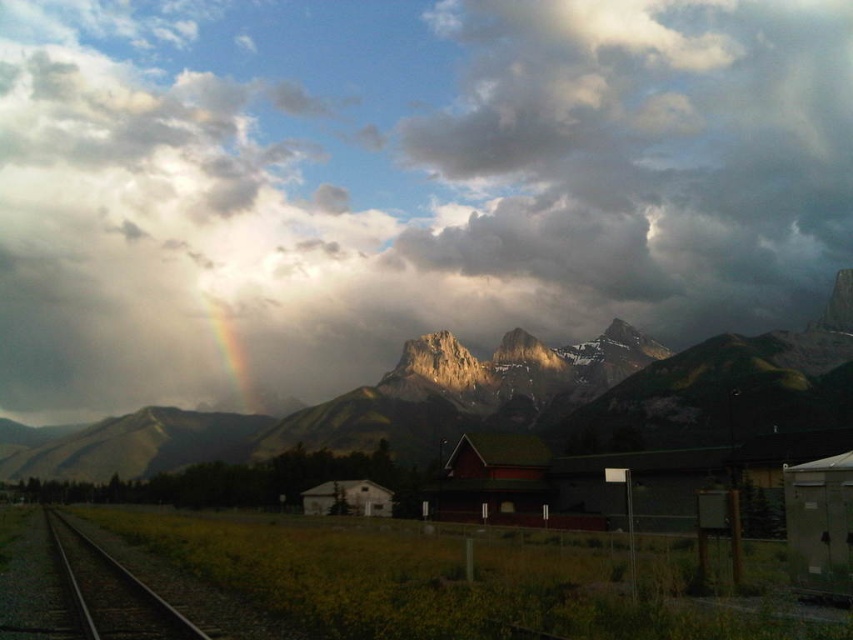
Question: Among these objects, which one is nearest to the camera?

Choices:
 (A) rainbow translucent at center
 (B) black metal train track at lower left

Answer: (B)

Question: Does rugged granite mountains at center appear on the right side of rainbow translucent at center?

Choices:
 (A) yes
 (B) no

Answer: (A)

Question: Does cloudy sky at upper center have a lesser width compared to black metal train track at lower left?

Choices:
 (A) no
 (B) yes

Answer: (A)

Question: Which is nearer to the cloudy sky at upper center?

Choices:
 (A) rainbow translucent at center
 (B) black metal train track at lower left

Answer: (A)

Question: Does cloudy sky at upper center have a greater width compared to rainbow translucent at center?

Choices:
 (A) no
 (B) yes

Answer: (B)

Question: Based on their relative distances, which object is nearer to the rugged granite mountains at center?

Choices:
 (A) black metal train track at lower left
 (B) cloudy sky at upper center
 (C) rainbow translucent at center

Answer: (C)